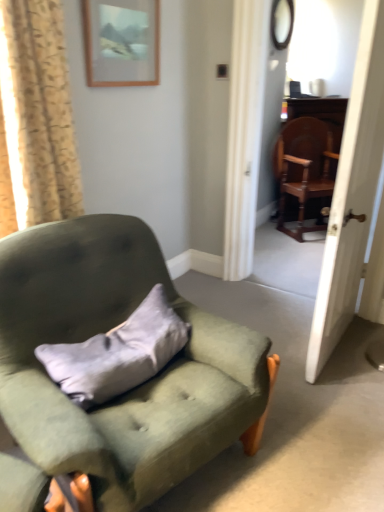
At what (x,y) coordinates should I click in order to perform the action: click on velvet green armchair at left, which appears as the 1th chair when viewed from the front. Please return your answer as a coordinate pair (x, y). This screenshot has width=384, height=512. Looking at the image, I should click on pyautogui.click(x=131, y=390).

The width and height of the screenshot is (384, 512). In order to click on beige floral fabric curtain at left in this screenshot , I will do `click(36, 118)`.

What do you see at coordinates (36, 118) in the screenshot? The image size is (384, 512). I see `beige floral fabric curtain at left` at bounding box center [36, 118].

Find the location of a particular element. matte wooden picture frame at upper center is located at coordinates (121, 42).

Is wooden screen door at right aimed at velvet green armchair at left, arranged as the 2th chair when viewed from the top?

No, wooden screen door at right does not turn towards velvet green armchair at left, arranged as the 2th chair when viewed from the top.

From a real-world perspective, is wooden screen door at right positioned over velvet green armchair at left, acting as the first chair starting from the bottom, based on gravity?

Yes, from a real-world perspective, wooden screen door at right is on top of velvet green armchair at left, acting as the first chair starting from the bottom.

Is wooden screen door at right outside of velvet green armchair at left, which appears as the second chair when viewed from the right?

Yes, wooden screen door at right is located beyond the bounds of velvet green armchair at left, which appears as the second chair when viewed from the right.

Is wooden screen door at right far away from velvet green armchair at left, which appears as the second chair when viewed from the right?

No, wooden screen door at right is in close proximity to velvet green armchair at left, which appears as the second chair when viewed from the right.

Considering the sizes of objects velvet green armchair at left, arranged as the 2th chair when viewed from the top, and matte wooden picture frame at upper center in the image provided, who is shorter, velvet green armchair at left, arranged as the 2th chair when viewed from the top, or matte wooden picture frame at upper center?

With less height is matte wooden picture frame at upper center.

Based on the photo, is velvet green armchair at left, acting as the second chair starting from the back, oriented towards matte wooden picture frame at upper center?

No, velvet green armchair at left, acting as the second chair starting from the back, is not turned towards matte wooden picture frame at upper center.

Does velvet green armchair at left, which appears as the 1th chair when viewed from the front, have a smaller size compared to matte wooden picture frame at upper center?

Actually, velvet green armchair at left, which appears as the 1th chair when viewed from the front, might be larger than matte wooden picture frame at upper center.

Which object is further away from the camera, wooden polished chair at right, which is the first chair from top to bottom, or matte wooden picture frame at upper center?

wooden polished chair at right, which is the first chair from top to bottom.

From the image's perspective, is wooden polished chair at right, the first chair from the back, under matte wooden picture frame at upper center?

Yes, from the image's perspective, wooden polished chair at right, the first chair from the back, is below matte wooden picture frame at upper center.

Does wooden polished chair at right, the 2th chair from the left, have a greater height compared to matte wooden picture frame at upper center?

Correct, wooden polished chair at right, the 2th chair from the left, is much taller as matte wooden picture frame at upper center.

Is point (66, 276) positioned after point (281, 149)?

No, it is in front of (281, 149).

From the image's perspective, is velvet green armchair at left, acting as the first chair starting from the bottom, beneath wooden polished chair at right, the first chair from the back?

Yes, from the image's perspective, velvet green armchair at left, acting as the first chair starting from the bottom, is below wooden polished chair at right, the first chair from the back.

Is velvet green armchair at left, arranged as the 2th chair when viewed from the top, at the right side of wooden polished chair at right, the 2th chair from the left?

In fact, velvet green armchair at left, arranged as the 2th chair when viewed from the top, is to the left of wooden polished chair at right, the 2th chair from the left.

Locate an element on the screen. This screenshot has width=384, height=512. chair beneath the wooden polished chair at right, which is the first chair from top to bottom (from a real-world perspective) is located at coordinates (131, 390).

At what (x,y) coordinates should I click in order to perform the action: click on chair above the gray suede pillow at center (from a real-world perspective). Please return your answer as a coordinate pair (x, y). This screenshot has width=384, height=512. Looking at the image, I should click on (304, 168).

Which of these two, gray suede pillow at center or wooden polished chair at right, which ranks as the first chair in right-to-left order, is bigger?

wooden polished chair at right, which ranks as the first chair in right-to-left order, is bigger.

Which is behind, point (110, 386) or point (299, 192)?

Point (299, 192)

From the image's perspective, is gray suede pillow at center on top of wooden polished chair at right, acting as the second chair starting from the bottom?

No.

Is wooden polished chair at right, which ranks as the first chair in right-to-left order, oriented towards beige floral fabric curtain at left?

No, wooden polished chair at right, which ranks as the first chair in right-to-left order, is not oriented towards beige floral fabric curtain at left.

Is wooden polished chair at right, acting as the second chair starting from the bottom, not near beige floral fabric curtain at left?

Yes, wooden polished chair at right, acting as the second chair starting from the bottom, and beige floral fabric curtain at left are quite far apart.

Locate an element on the screen. The image size is (384, 512). curtain in front of the wooden polished chair at right, the 2th chair from the left is located at coordinates (36, 118).

Does wooden polished chair at right, the 2th chair from the left, have a lesser width compared to beige floral fabric curtain at left?

No, wooden polished chair at right, the 2th chair from the left, is not thinner than beige floral fabric curtain at left.

At what (x,y) coordinates should I click in order to perform the action: click on pillow that is below the wooden screen door at right (from the image's perspective). Please return your answer as a coordinate pair (x, y). Looking at the image, I should click on (117, 353).

From the image's perspective, which is below, gray suede pillow at center or wooden screen door at right?

From the image's view, gray suede pillow at center is below.

Considering the sizes of objects gray suede pillow at center and wooden screen door at right in the image provided, who is taller, gray suede pillow at center or wooden screen door at right?

Standing taller between the two is wooden screen door at right.

Which point is more distant from viewer, (142, 380) or (311, 333)?

The point (311, 333) is farther.

Where is `screen door located on the right of velvet green armchair at left, acting as the second chair starting from the back`? The width and height of the screenshot is (384, 512). screen door located on the right of velvet green armchair at left, acting as the second chair starting from the back is located at coordinates (351, 194).

From a real-world perspective, count 2nd chairs downward from the matte wooden picture frame at upper center and point to it. Please provide its 2D coordinates.

[(131, 390)]

Estimate the real-world distances between objects in this image. Which object is further from gray suede pillow at center, velvet green armchair at left, which appears as the 1th chair when viewed from the left, or beige floral fabric curtain at left?

beige floral fabric curtain at left lies further to gray suede pillow at center than the other object.

Considering their positions, is wooden screen door at right positioned closer to gray suede pillow at center than velvet green armchair at left, acting as the second chair starting from the back?

The object closer to gray suede pillow at center is velvet green armchair at left, acting as the second chair starting from the back.

Based on their spatial positions, is matte wooden picture frame at upper center or wooden screen door at right closer to velvet green armchair at left, acting as the first chair starting from the bottom?

Among the two, wooden screen door at right is located nearer to velvet green armchair at left, acting as the first chair starting from the bottom.

Looking at the image, which one is located closer to gray suede pillow at center, matte wooden picture frame at upper center or velvet green armchair at left, which appears as the second chair when viewed from the right?

Among the two, velvet green armchair at left, which appears as the second chair when viewed from the right, is located nearer to gray suede pillow at center.

Which object lies further to the anchor point velvet green armchair at left, which appears as the 1th chair when viewed from the front, beige floral fabric curtain at left or wooden polished chair at right, which is the first chair from top to bottom?

Based on the image, wooden polished chair at right, which is the first chair from top to bottom, appears to be further to velvet green armchair at left, which appears as the 1th chair when viewed from the front.

When comparing their distances from beige floral fabric curtain at left, does gray suede pillow at center or wooden screen door at right seem closer?

gray suede pillow at center is positioned closer to the anchor beige floral fabric curtain at left.

Based on their spatial positions, is beige floral fabric curtain at left or matte wooden picture frame at upper center closer to wooden polished chair at right, acting as the second chair starting from the bottom?

Among the two, matte wooden picture frame at upper center is located nearer to wooden polished chair at right, acting as the second chair starting from the bottom.

Considering their positions, is velvet green armchair at left, arranged as the 2th chair when viewed from the top, positioned further to gray suede pillow at center than matte wooden picture frame at upper center?

The object further to gray suede pillow at center is matte wooden picture frame at upper center.

Locate an element on the screen. screen door between velvet green armchair at left, arranged as the 2th chair when viewed from the top, and wooden polished chair at right, the first chair from the back, from front to back is located at coordinates (351, 194).

In order to click on screen door between matte wooden picture frame at upper center and gray suede pillow at center in the vertical direction in this screenshot , I will do `click(351, 194)`.

This screenshot has height=512, width=384. Find the location of `screen door between matte wooden picture frame at upper center and velvet green armchair at left, acting as the second chair starting from the back, in the up-down direction`. screen door between matte wooden picture frame at upper center and velvet green armchair at left, acting as the second chair starting from the back, in the up-down direction is located at coordinates (351, 194).

At what (x,y) coordinates should I click in order to perform the action: click on picture frame positioned between gray suede pillow at center and wooden polished chair at right, the 2th chair from the left, from near to far. Please return your answer as a coordinate pair (x, y). Looking at the image, I should click on (121, 42).